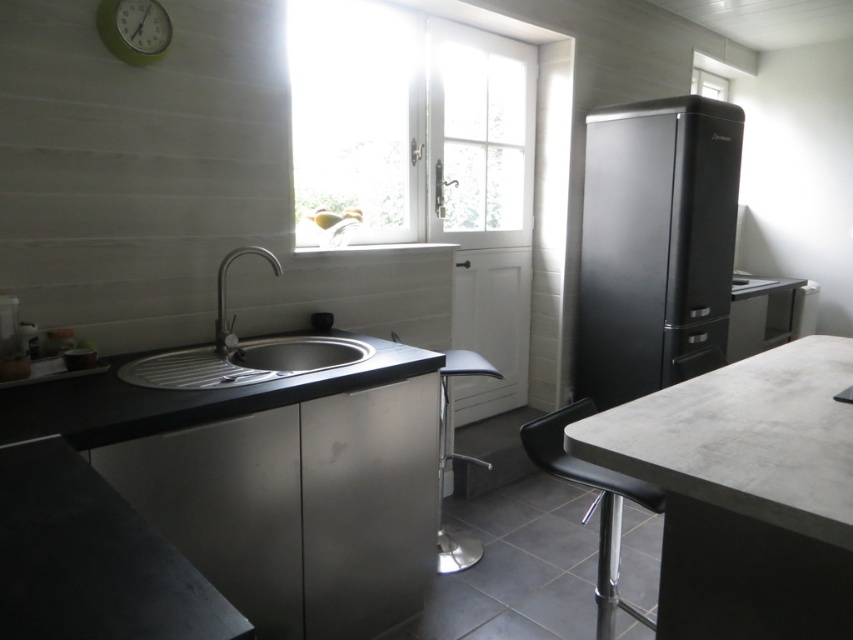
Question: Which of the following is the farthest from the observer?

Choices:
 (A) (577, 404)
 (B) (210, 353)

Answer: (B)

Question: Which point is farther from the camera taking this photo?

Choices:
 (A) (223, 326)
 (B) (476, 371)
 (C) (483, 116)
 (D) (718, 90)

Answer: (D)

Question: In this image, where is metallic silver bar stool at center located relative to polished silver faucet at sink left?

Choices:
 (A) right
 (B) left

Answer: (A)

Question: Which point is closer to the camera?

Choices:
 (A) pyautogui.click(x=386, y=118)
 (B) pyautogui.click(x=231, y=336)
 (C) pyautogui.click(x=320, y=394)
 (D) pyautogui.click(x=271, y=262)

Answer: (C)

Question: In this image, where is satin nickel sink at center located relative to green matte clock at upper left?

Choices:
 (A) above
 (B) below

Answer: (B)

Question: Is satin nickel sink at center positioned in front of polished silver faucet at sink left?

Choices:
 (A) no
 (B) yes

Answer: (B)